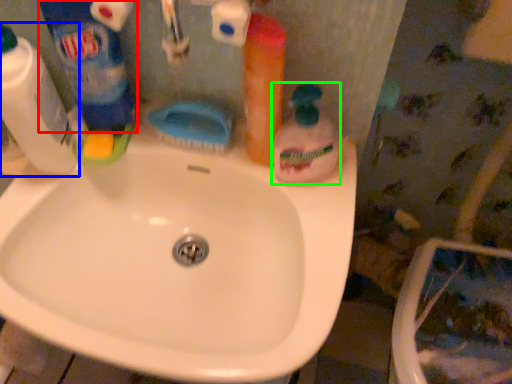
Question: Which object is the farthest from cleaning product (highlighted by a red box)? Choose among these: cleaning product (highlighted by a blue box) or cleaning product (highlighted by a green box).

Choices:
 (A) cleaning product
 (B) cleaning product

Answer: (B)